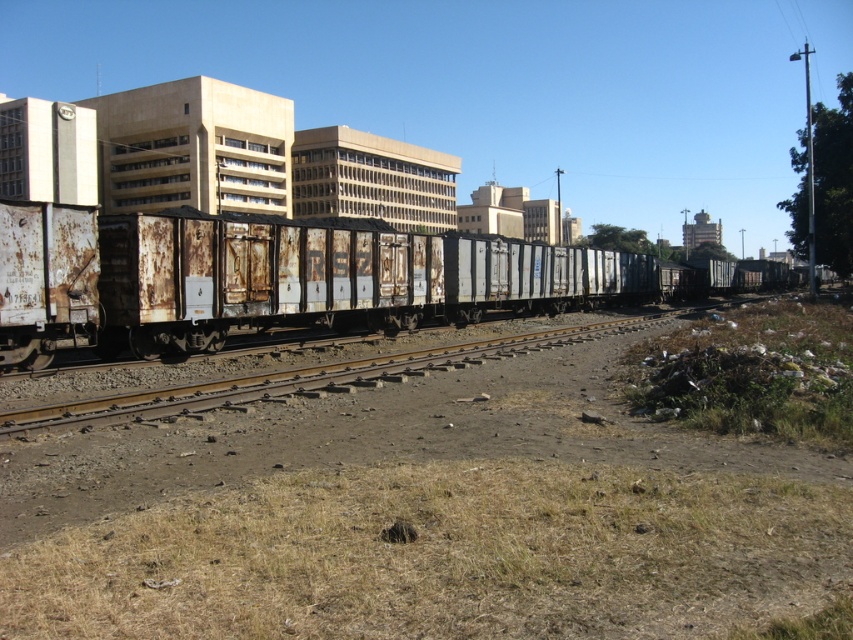
Consider the image. Can you confirm if rusty metal train carriages at left is bigger than rusty metal train carriages at center?

Indeed, rusty metal train carriages at left has a larger size compared to rusty metal train carriages at center.

Does rusty metal train carriages at left appear on the left side of rusty metal train carriages at center?

Incorrect, rusty metal train carriages at left is not on the left side of rusty metal train carriages at center.

Which is in front, point (546, 280) or point (495, 358)?

Point (495, 358)

This screenshot has width=853, height=640. I want to click on rusty metal train carriages at left, so click(265, 280).